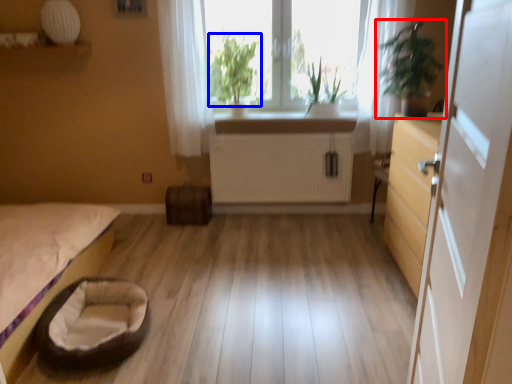
Question: Which point is closer to the camera, houseplant (highlighted by a red box) or plant (highlighted by a blue box)?

Choices:
 (A) houseplant
 (B) plant

Answer: (A)